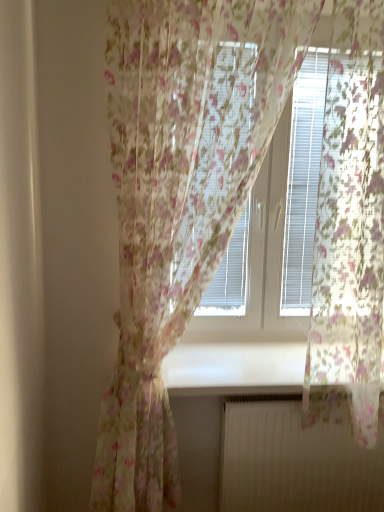
Question: From the image's perspective, relative to white matte radiator at lower center, is white glossy window sill at center above or below?

Choices:
 (A) below
 (B) above

Answer: (B)

Question: Is white glossy window sill at center spatially inside white matte radiator at lower center, or outside of it?

Choices:
 (A) inside
 (B) outside

Answer: (B)

Question: Which object is the farthest from the white glossy window sill at center?

Choices:
 (A) white plastic blinds at upper center
 (B) white matte radiator at lower center

Answer: (A)

Question: Which is nearer to the white matte radiator at lower center?

Choices:
 (A) white plastic blinds at upper center
 (B) white glossy window sill at center

Answer: (B)